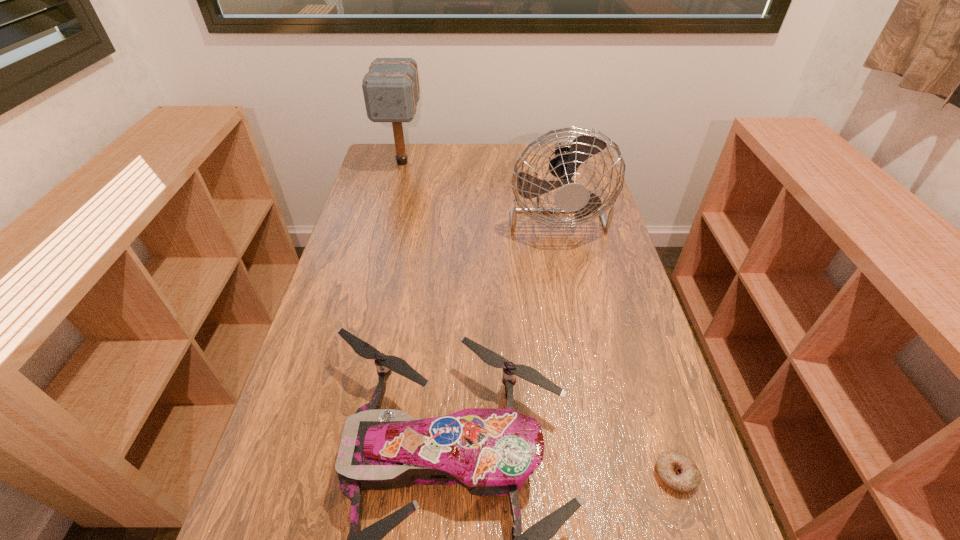
The image size is (960, 540). Identify the location of mallet. (391, 91).

Identify the location of fan. (572, 197).

Find the location of a particular element. The image size is (960, 540). doughnut is located at coordinates (676, 470).

Find the location of a particular element. This screenshot has width=960, height=540. vacant position located on the striking surface of the mallet is located at coordinates (391, 208).

This screenshot has width=960, height=540. In order to click on blank area located 0.150m on the front-facing side of the fan in this screenshot , I will do `click(571, 286)`.

I want to click on free region located 0.110m on the left of the shortest object, so click(598, 475).

Locate an element on the screen. mallet that is at the far edge is located at coordinates (391, 91).

Locate an element on the screen. The height and width of the screenshot is (540, 960). fan that is at the far edge is located at coordinates (572, 197).

Identify the location of object located in the left edge section of the desktop. Image resolution: width=960 pixels, height=540 pixels. (391, 91).

Find the location of a particular element. The height and width of the screenshot is (540, 960). fan present at the right edge is located at coordinates (572, 197).